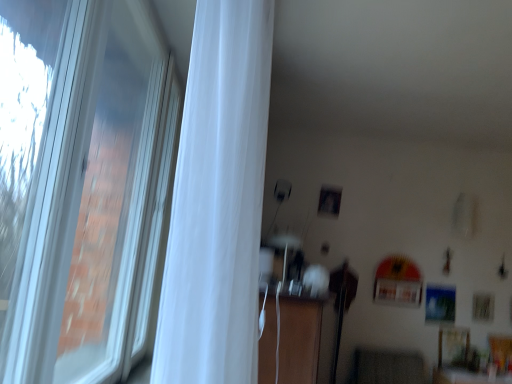
Question: Can you confirm if wooden dresser at center is taller than white sheer curtain at left?

Choices:
 (A) yes
 (B) no

Answer: (B)

Question: Is the position of wooden dresser at center more distant than that of white sheer curtain at left?

Choices:
 (A) yes
 (B) no

Answer: (A)

Question: Considering the relative positions of wooden dresser at center and white sheer curtain at left in the image provided, is wooden dresser at center to the left of white sheer curtain at left from the viewer's perspective?

Choices:
 (A) yes
 (B) no

Answer: (B)

Question: Can you confirm if wooden dresser at center is bigger than white sheer curtain at left?

Choices:
 (A) yes
 (B) no

Answer: (A)

Question: Does wooden dresser at center turn towards white sheer curtain at left?

Choices:
 (A) no
 (B) yes

Answer: (A)

Question: Does wooden dresser at center appear on the right side of white sheer curtain at left?

Choices:
 (A) no
 (B) yes

Answer: (B)

Question: Does white sheer curtain at left have a larger size compared to white plastic window at left?

Choices:
 (A) yes
 (B) no

Answer: (B)

Question: Considering the relative positions of white sheer curtain at left and white plastic window at left in the image provided, is white sheer curtain at left to the left of white plastic window at left from the viewer's perspective?

Choices:
 (A) yes
 (B) no

Answer: (B)

Question: Is white sheer curtain at left at the right side of white plastic window at left?

Choices:
 (A) no
 (B) yes

Answer: (B)

Question: From the image's perspective, is white sheer curtain at left below white plastic window at left?

Choices:
 (A) no
 (B) yes

Answer: (A)

Question: Is white sheer curtain at left positioned before white plastic window at left?

Choices:
 (A) yes
 (B) no

Answer: (B)

Question: Is white plastic window at left completely or partially inside white sheer curtain at left?

Choices:
 (A) yes
 (B) no

Answer: (B)

Question: Would you say white sheer curtain at left is part of white plastic window at left's contents?

Choices:
 (A) no
 (B) yes

Answer: (A)